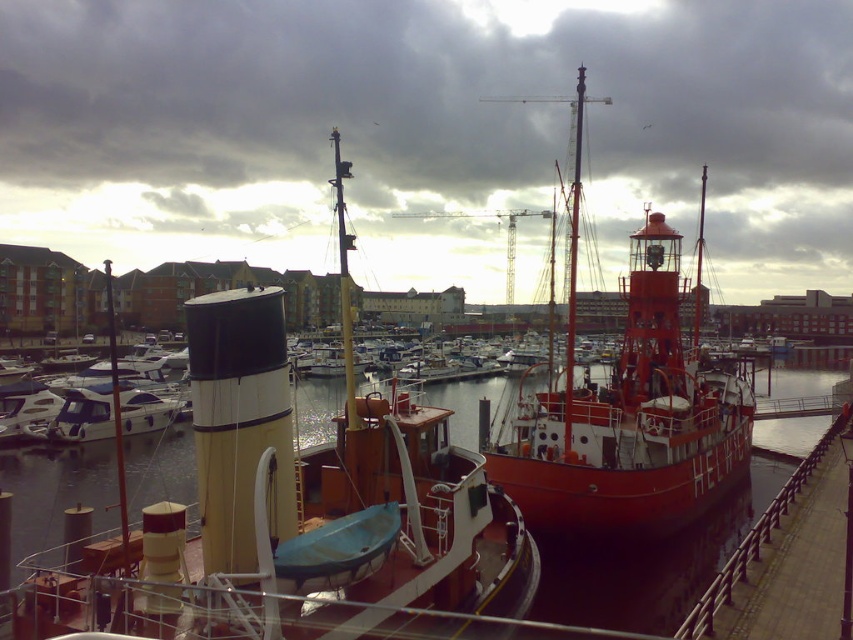
You are standing at the pier looking at the two ships. There are two points marked on the image. Which point is closer to you, point (250, 596) or point (592, 576)?

Point (250, 596) is closer to you than point (592, 576).

You are a harbor master trying to navigate a new boat into the marina. You need to dock it near the shiny red boat at center. According to the coordinates provided, where should you aim to place the new boat?

The shiny red boat at center is located at point (627,412), so you should aim to place the new boat near those coordinates to dock it close to the shiny red boat at center.

You are standing at the pier looking out at the two ships. According to the coordinates provided, which point is closer to you, point (x=479, y=612) or point (x=643, y=436)?

Point (x=479, y=612) is in front of point (x=643, y=436), so it is closer to you.